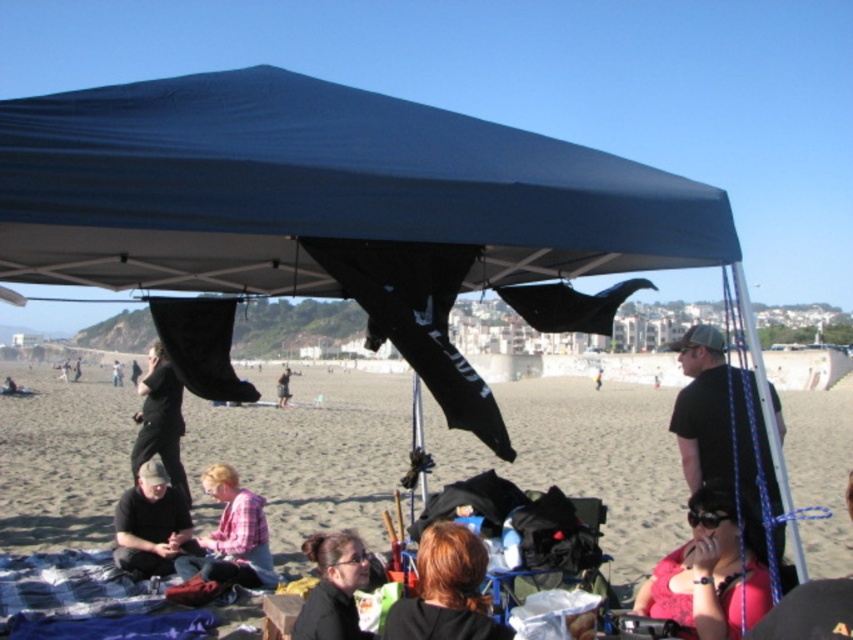
You are standing at the center of the tent and want to place a small cooler at the point marked as point (x=711, y=413). Is this point located on the black matte t shirt at right?

Yes, the point (x=711, y=413) is on the black matte t shirt at right, so placing the cooler there would place it directly on the t shirt.